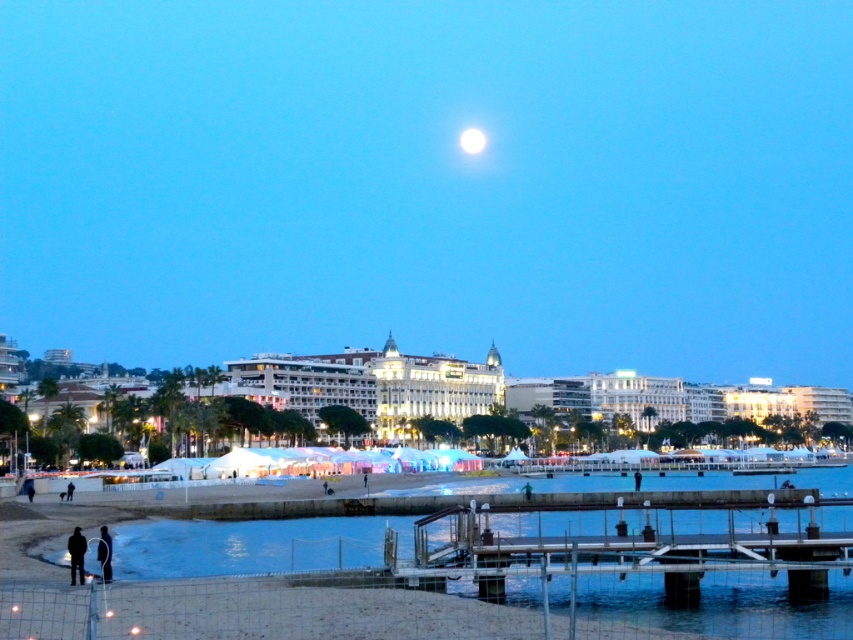
You are standing on the beach and want to reach the metallic gray dock at lower center without getting your feet wet. Can you walk directly to it from your current position near the dark clothing figure at lower left?

The metallic gray dock at lower center is positioned over dark clothing figure at lower left, meaning the dock is directly above the figure. Since the dock is over the figure, there is no water between them, so you can walk directly to the dock without getting your feet wet.

You are standing on the beach and want to take a photo of both point (798, 508) and point (82, 577) in the same frame. Which point should you focus on first to ensure both are in focus?

You should focus on point (798, 508) first because it is closer to the camera than point (82, 577). This ensures the closer point is in focus, and the farther point will also be sharp due to depth of field.